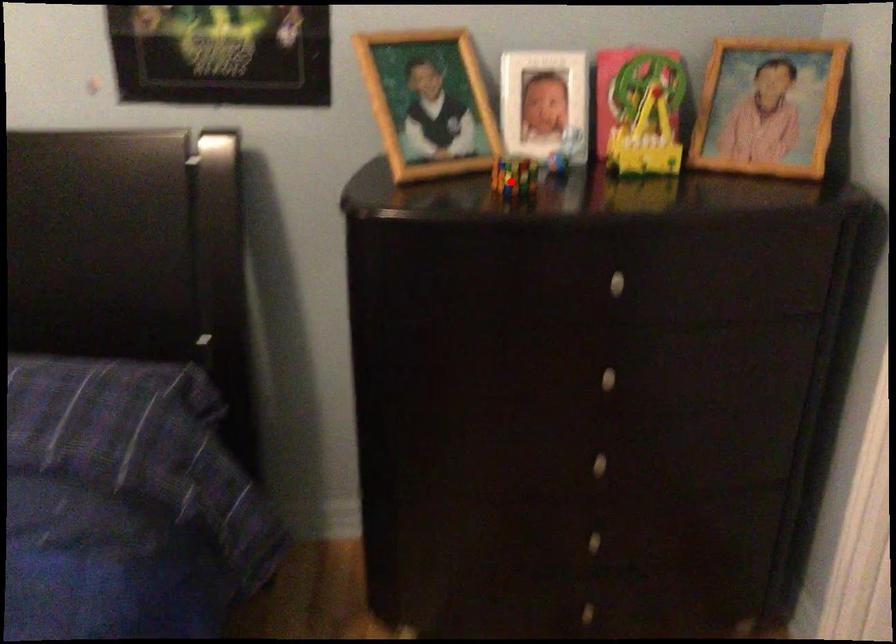
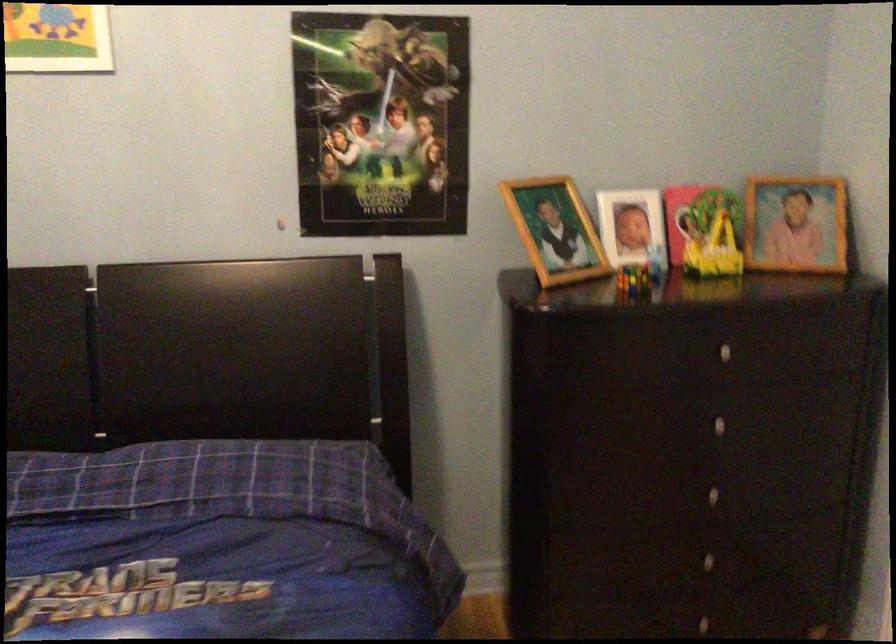
Question: I am providing you with two images of the same scene from different viewpoints. Given a red point in image1, look at the same physical point in image2. Is it:

Choices:
 (A) Closer to the viewpoint
 (B) Farther from the viewpoint

Answer: (B)